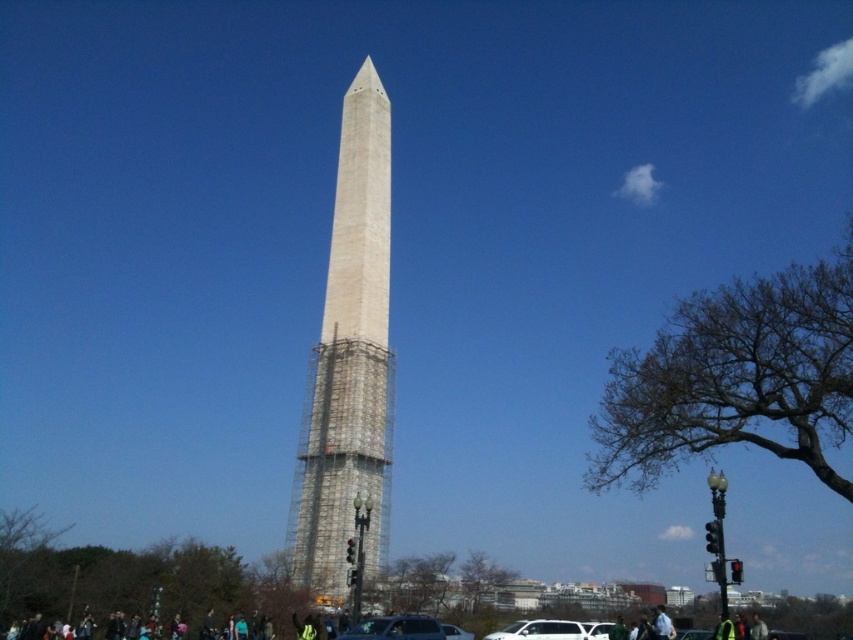
You are a tour guide leading a group to the Washington Monument. Your group is currently standing at the white matte car at center. Which direction should you walk to reach the white marble tower at center?

You should walk to your left to reach the white marble tower at center because it is located to the left of the white matte car at center.

You are a tour guide explaining the Washington Monument to your group. You point out the white marble tower at center and the silver metallic car at center. Which one is higher in the image?

The white marble tower at center is located above the silver metallic car at center, so it is higher in the image.

You are a tourist standing at the Washington Monument and want to take a photo of both the metallic silver car at center and the white matte car at center. Which car should you position yourself to the left of to include both in your shot?

You should position yourself to the left of the white matte car at center because the metallic silver car at center is already to the left of it, allowing both cars to be captured in the photo.